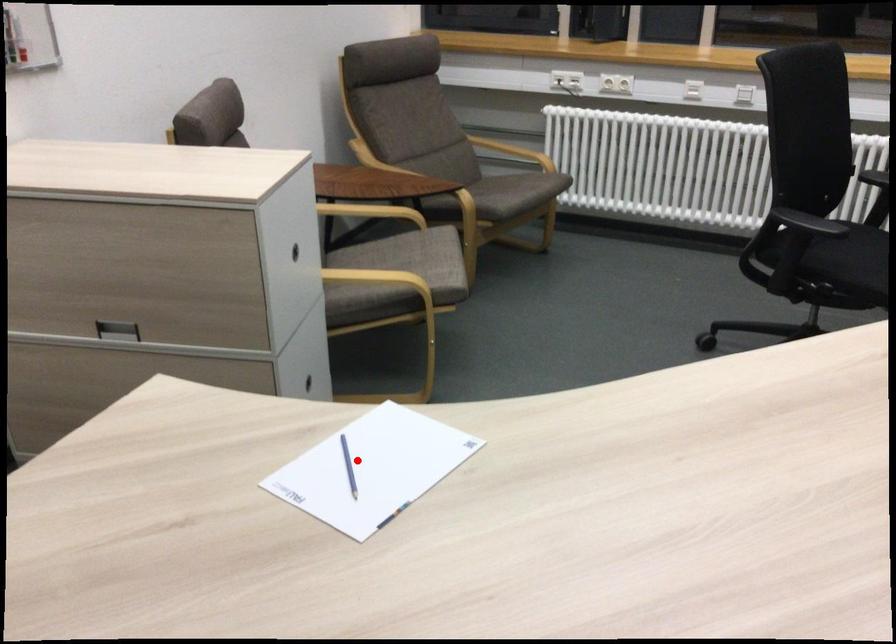
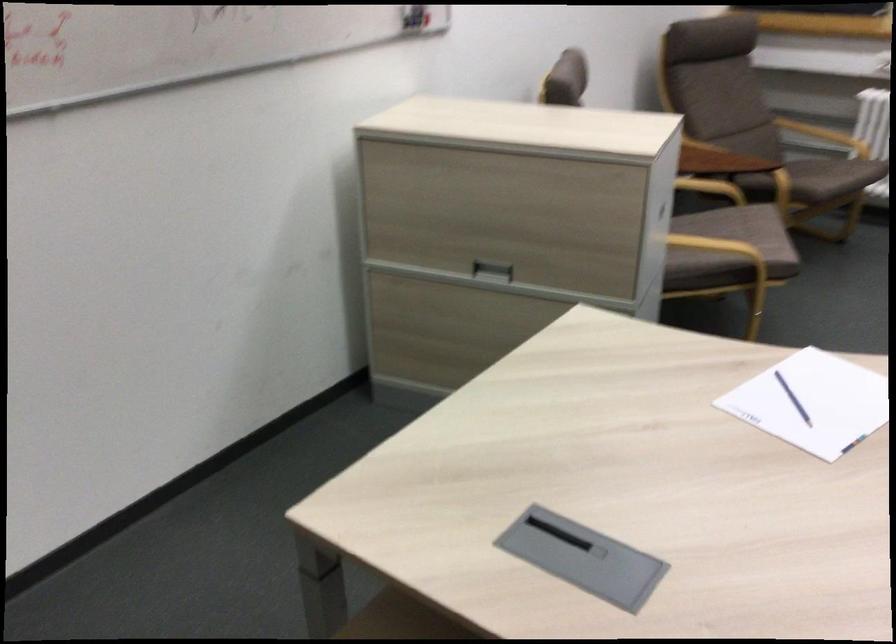
Find the pixel in the second image that matches the highlighted location in the first image.

(793, 399)